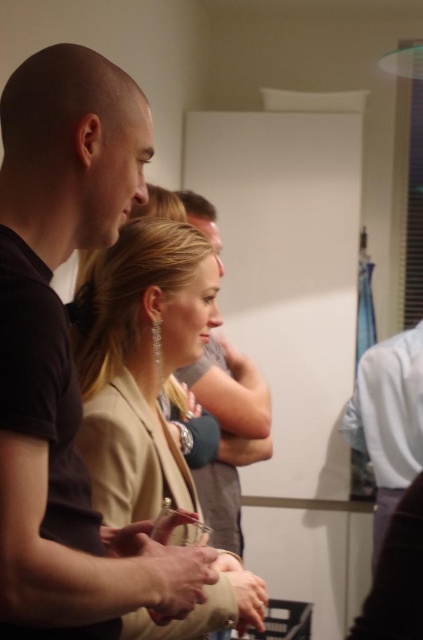
Question: Does black matte shirt at left appear under satin beige blazer at center?

Choices:
 (A) yes
 (B) no

Answer: (B)

Question: Is black matte shirt at left to the left of satin beige blazer at center from the viewer's perspective?

Choices:
 (A) yes
 (B) no

Answer: (A)

Question: Which point is closer to the camera?

Choices:
 (A) (206, 269)
 (B) (69, 512)

Answer: (B)

Question: Which of the following is the closest to the observer?

Choices:
 (A) satin beige blazer at center
 (B) black matte shirt at left

Answer: (B)

Question: Is black matte shirt at left further to camera compared to satin beige blazer at center?

Choices:
 (A) yes
 (B) no

Answer: (B)